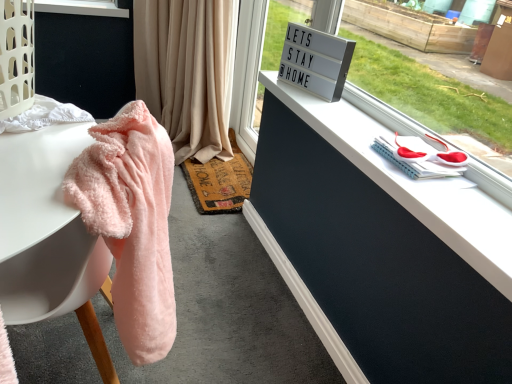
Identify the location of space that is in front of rustic woven mat at center. The image size is (512, 384). (204, 238).